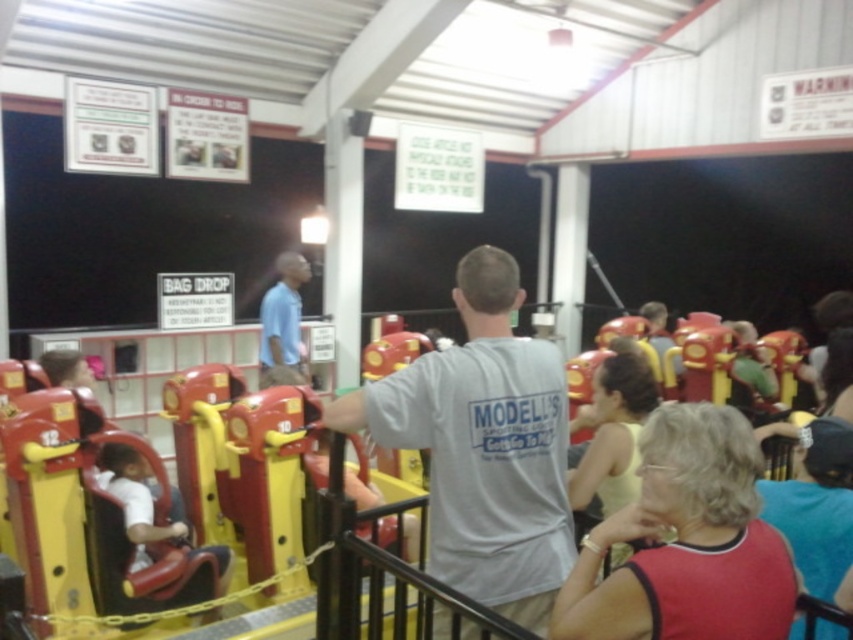
Who is shorter, gray cotton t-shirt at center or light blue shirt at center?

light blue shirt at center is shorter.

Between point (456, 458) and point (279, 253), which one is positioned in front?

Point (456, 458) is more forward.

I want to click on gray cotton t-shirt at center, so click(483, 445).

Identify the location of gray cotton t-shirt at center. The height and width of the screenshot is (640, 853). (483, 445).

Describe the element at coordinates (686, 541) in the screenshot. I see `red fabric shirt at lower right` at that location.

Is red fabric shirt at lower right smaller than light blue shirt at center?

Correct, red fabric shirt at lower right occupies less space than light blue shirt at center.

Is point (577, 604) closer to viewer compared to point (267, 316)?

Yes, it is.

This screenshot has width=853, height=640. In order to click on red fabric shirt at lower right in this screenshot , I will do `click(686, 541)`.

Does gray cotton t-shirt at center have a larger size compared to red fabric shirt at lower right?

Yes.

At what (x,y) coordinates should I click in order to perform the action: click on gray cotton t-shirt at center. Please return your answer as a coordinate pair (x, y). Image resolution: width=853 pixels, height=640 pixels. Looking at the image, I should click on (483, 445).

Identify the location of gray cotton t-shirt at center. (483, 445).